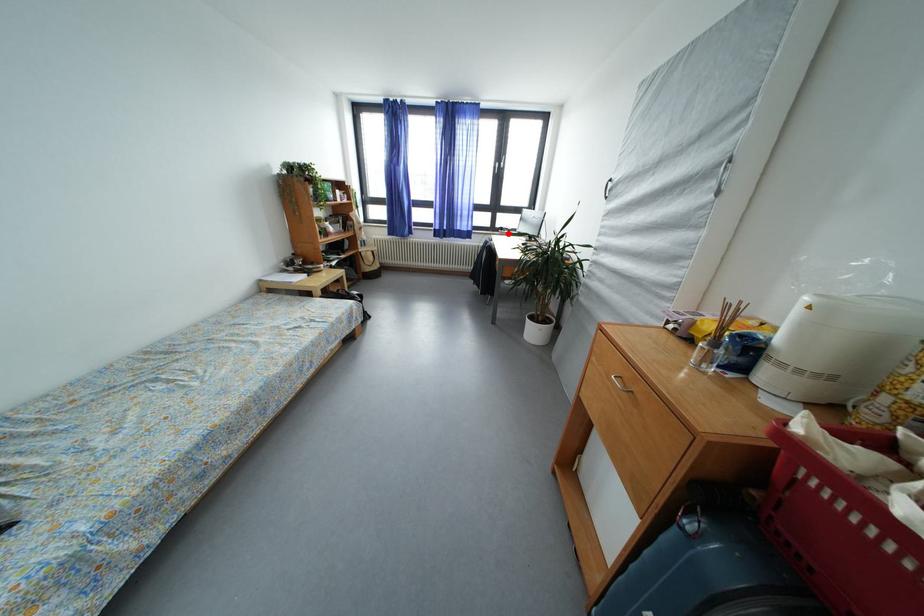
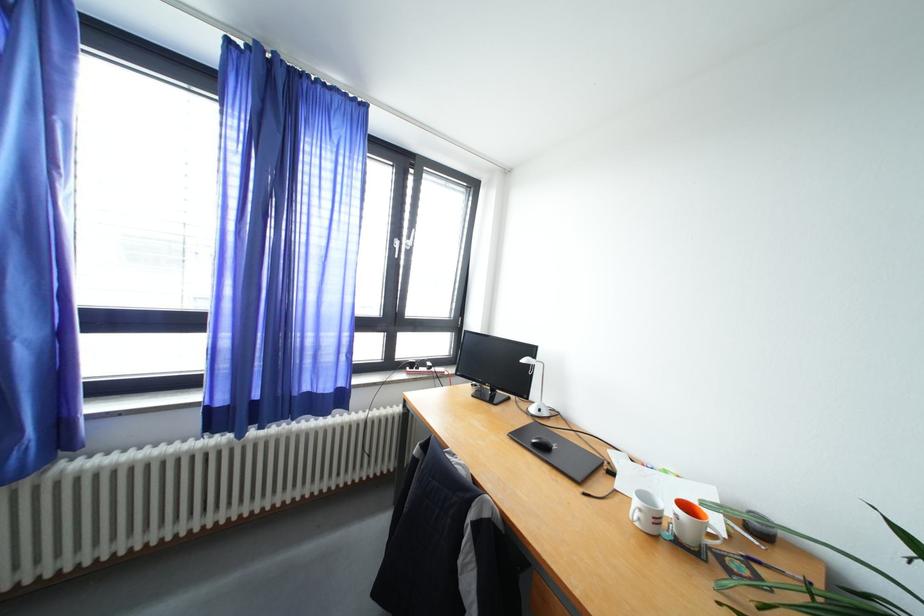
Question: A red point is marked in image1. In image2, is the corresponding 3D point closer to the camera or farther? Reply with the corresponding letter.

Choices:
 (A) The corresponding 3D point is closer.
 (B) The corresponding 3D point is farther.

Answer: (B)